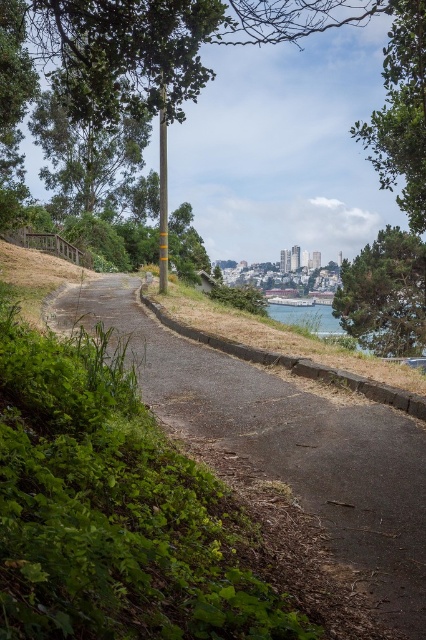
Is green leafy tree at left above green textured tree at right?

Yes, green leafy tree at left is above green textured tree at right.

In the scene shown: Is green leafy tree at left below green textured tree at right?

Actually, green leafy tree at left is above green textured tree at right.

Based on the photo, measure the distance between green leafy tree at left and camera.

A distance of 32.18 feet exists between green leafy tree at left and camera.

Locate an element on the screen. green leafy tree at left is located at coordinates (111, 58).

Is point (397, 266) behind point (284, 312)?

That is False.

This screenshot has width=426, height=640. I want to click on green textured tree at right, so click(x=385, y=294).

Who is more forward, (x=365, y=264) or (x=394, y=352)?

Positioned in front is point (x=394, y=352).

Where is `green textured tree at right`? The image size is (426, 640). green textured tree at right is located at coordinates (385, 294).

Is point (305, 397) closer to camera compared to point (298, 308)?

Yes, it is.

Is green grass at lower left wider than clear water at lower right?

No, green grass at lower left is not wider than clear water at lower right.

Is point (232, 417) positioned after point (307, 326)?

That is False.

This screenshot has height=640, width=426. Identify the location of green grass at lower left. (287, 444).